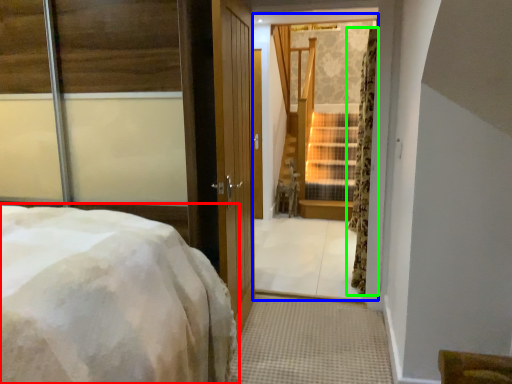
Question: Estimate the real-world distances between objects in this image. Which object is farther from bed (highlighted by a red box), window (highlighted by a blue box) or curtain (highlighted by a green box)?

Choices:
 (A) window
 (B) curtain

Answer: (A)